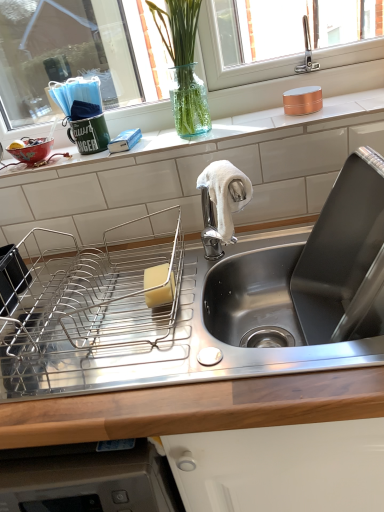
Where is `free space above white tile at upper center (from a real-world perspective)`? The height and width of the screenshot is (512, 384). free space above white tile at upper center (from a real-world perspective) is located at coordinates (201, 134).